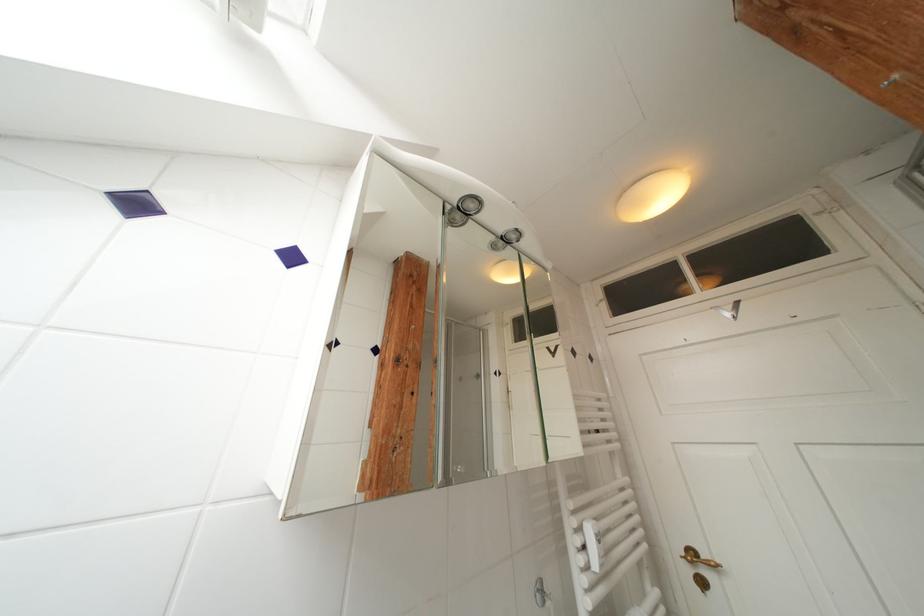
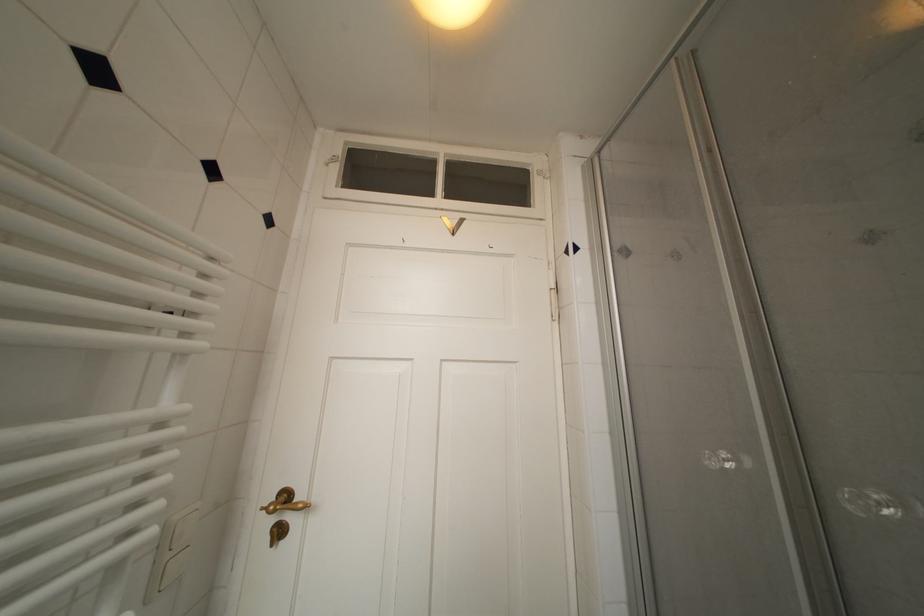
Where in the second image is the point corresponding to point (699, 557) from the first image?

(293, 500)